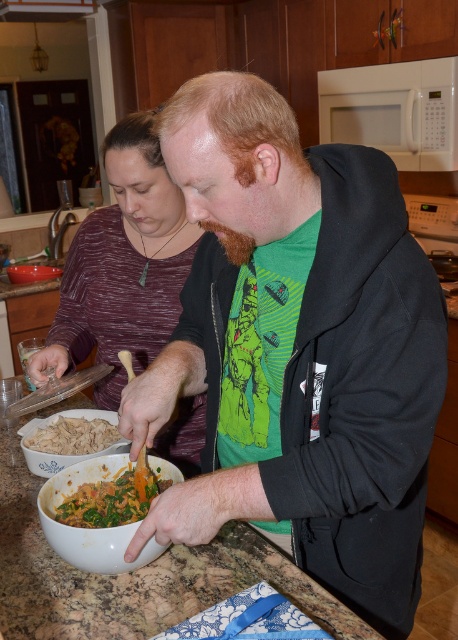
You are a chef trying to store the chopped green vegetables at center in the white matte microwave at upper center. Is there enough space to fit them inside?

The white matte microwave at upper center is larger in size than chopped green vegetables at center, so yes, the chopped green vegetables at center can fit inside the white matte microwave at upper center.

You are standing in the kitchen and want to place a small bowl between the two points labeled point [44,604] and point [344,81]. Based on their positions, which point should the bowl be closer to?

The bowl should be placed closer to point [44,604] because it is in front of point [344,81].

You are a chef in a busy kitchen and need to quickly access both the white matte microwave at upper center and the chopped green vegetables at center. Based on their positions, which object is closer to your right hand when standing in front of them?

The white matte microwave at upper center is positioned on the right side of chopped green vegetables at center, so it would be closer to your right hand when standing in front of them.